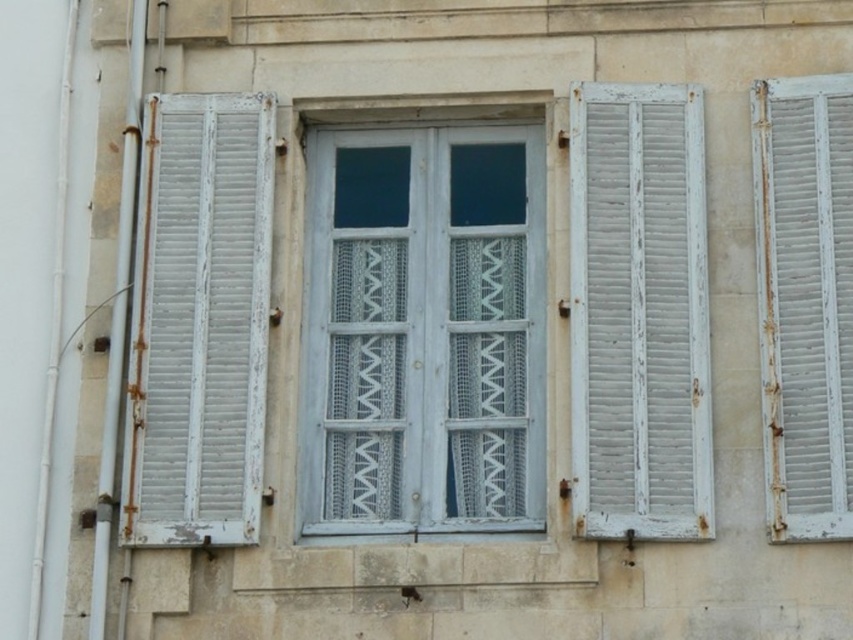
Who is shorter, white weathered wood shutter at left or white wooden shutter at right?

white weathered wood shutter at left is shorter.

Does point (173, 458) lie behind point (799, 513)?

Yes, it is behind point (799, 513).

Is point (257, 282) positioned before point (793, 451)?

No, (257, 282) is behind (793, 451).

In order to click on white weathered wood shutter at left in this screenshot , I will do `click(199, 321)`.

Can you confirm if white textured wood window at center is positioned to the right of white wooden shutters at right?

No, white textured wood window at center is not to the right of white wooden shutters at right.

Does point (424, 209) lie behind point (648, 516)?

Yes, point (424, 209) is behind point (648, 516).

Image resolution: width=853 pixels, height=640 pixels. In order to click on white textured wood window at center in this screenshot , I will do `click(422, 332)`.

Between white textured wood window at center and white wooden shutter at right, which one has less height?

white textured wood window at center is shorter.

Which of these two, white textured wood window at center or white wooden shutter at right, stands taller?

white wooden shutter at right is taller.

Which is behind, point (448, 452) or point (776, 129)?

The point (776, 129) is behind.

I want to click on white textured wood window at center, so click(422, 332).